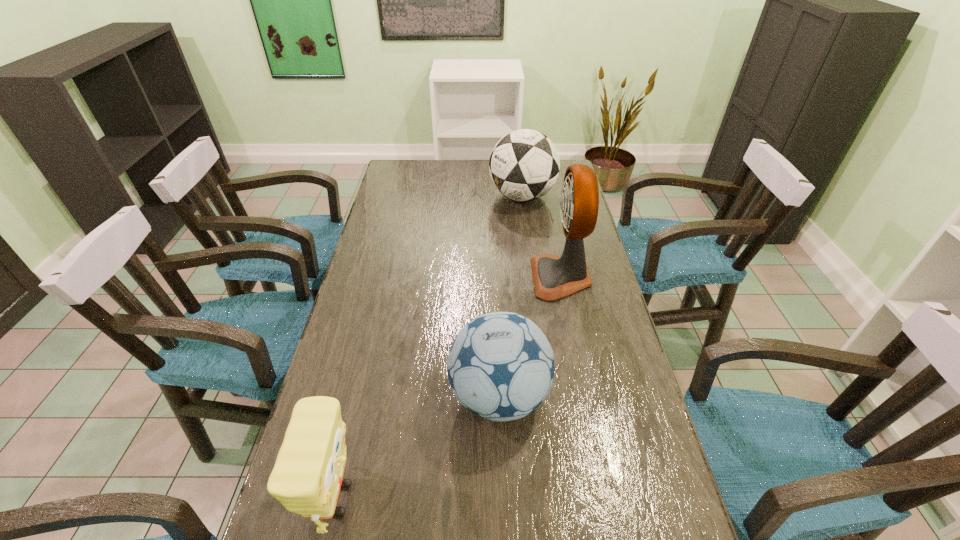
Locate an element on the screen. The image size is (960, 540). fan is located at coordinates (554, 277).

Find the location of a particular element. the tallest object is located at coordinates (554, 277).

Where is `the farthest object`? the farthest object is located at coordinates (524, 165).

Identify the location of the second nearest object. The image size is (960, 540). (500, 366).

Find the location of a particular element. vacant space located 0.220m on the front-facing side of the tallest object is located at coordinates (464, 278).

Locate an element on the screen. The image size is (960, 540). free space located on the front-facing side of the tallest object is located at coordinates (432, 278).

You are a GUI agent. You are given a task and a screenshot of the screen. Output one action in this format:
    pyautogui.click(x=<x>, y=<y>)
    Task: Click on the free space located on the front-facing side of the tallest object
    Image resolution: width=960 pixels, height=540 pixels.
    Given the screenshot: What is the action you would take?
    pyautogui.click(x=439, y=278)

In order to click on vacant space located on the surface of the farthest object where the brand logo is visible in this screenshot , I will do `click(453, 197)`.

Where is `vacant region located 0.100m on the surface of the farthest object where the brand logo is visible`? The image size is (960, 540). vacant region located 0.100m on the surface of the farthest object where the brand logo is visible is located at coordinates (464, 197).

The height and width of the screenshot is (540, 960). Find the location of `free spot located on the surface of the farthest object where the brand logo is visible`. free spot located on the surface of the farthest object where the brand logo is visible is located at coordinates (403, 197).